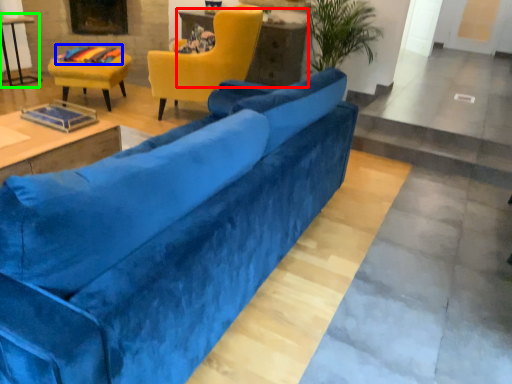
Question: Estimate the real-world distances between objects in this image. Which object is farther from table (highlighted by a red box), material (highlighted by a blue box) or table (highlighted by a green box)?

Choices:
 (A) material
 (B) table

Answer: (B)